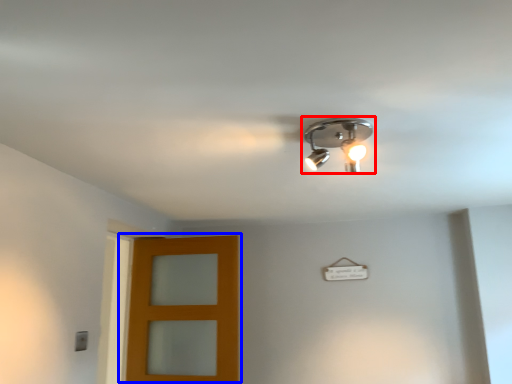
Question: Which object is further to the camera taking this photo, lamp (highlighted by a red box) or door (highlighted by a blue box)?

Choices:
 (A) lamp
 (B) door

Answer: (B)